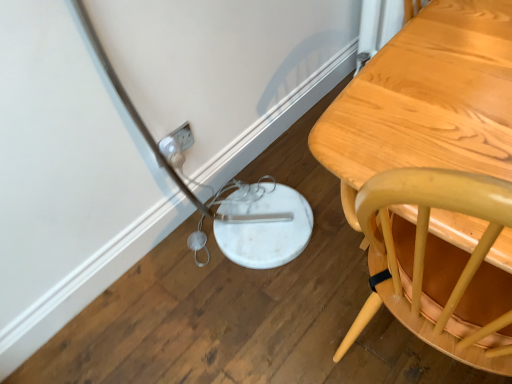
Question: Is white plastic plug at lower left wider or thinner than light brown wooden table at right?

Choices:
 (A) thin
 (B) wide

Answer: (A)

Question: From a real-world perspective, is white plastic plug at lower left physically located above or below light brown wooden table at right?

Choices:
 (A) above
 (B) below

Answer: (B)

Question: In the image, is white plastic plug at lower left positioned in front of or behind light brown wooden table at right?

Choices:
 (A) front
 (B) behind

Answer: (B)

Question: Is light brown wooden table at right inside the boundaries of white plastic plug at lower left, or outside?

Choices:
 (A) inside
 (B) outside

Answer: (B)

Question: From a real-world perspective, relative to white plastic plug at lower left, is light brown wooden table at right vertically above or below?

Choices:
 (A) below
 (B) above

Answer: (B)

Question: In the image, is light brown wooden table at right positioned in front of or behind white plastic plug at lower left?

Choices:
 (A) front
 (B) behind

Answer: (A)

Question: Considering the positions of light brown wooden table at right and white plastic plug at lower left in the image, is light brown wooden table at right bigger or smaller than white plastic plug at lower left?

Choices:
 (A) big
 (B) small

Answer: (A)